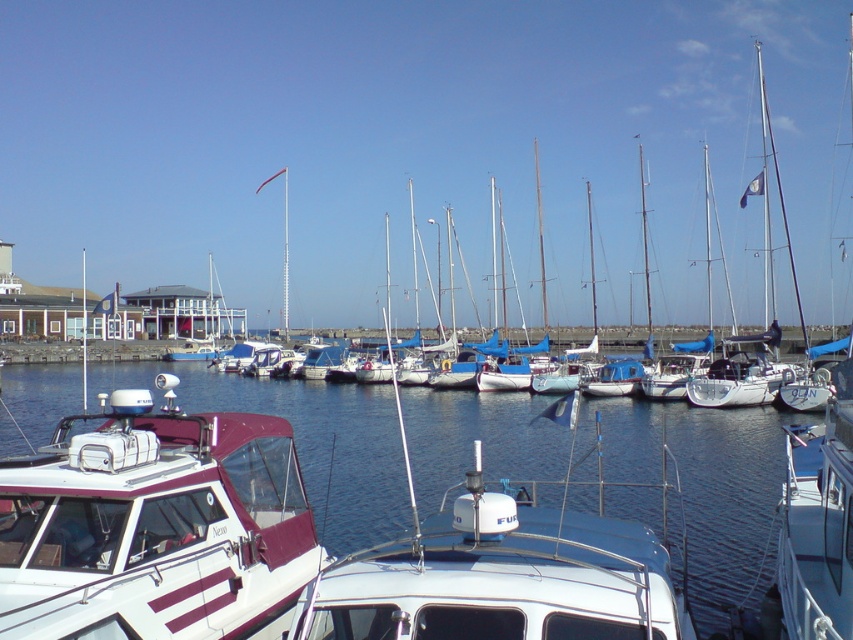
You are standing at the edge of the marina looking out. There is a point marked at coordinates point (x=695, y=486). What is located at that point?

The point (x=695, y=486) marks clear water at center.

You are standing at the center of the marina. Which direction should you walk to reach the maroon matte boat at lower left?

You should walk towards the lower left direction to reach the maroon matte boat at lower left, as it is located at point (x=155, y=525).